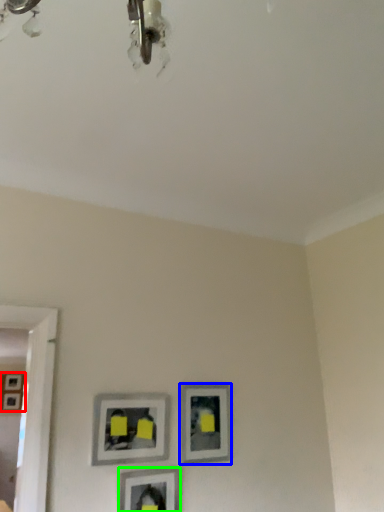
Question: Which object is positioned closest to picture frame (highlighted by a red box)? Select from picture frame (highlighted by a blue box) and picture frame (highlighted by a green box).

Choices:
 (A) picture frame
 (B) picture frame

Answer: (A)